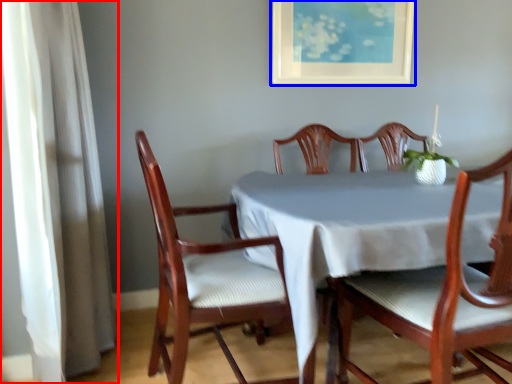
Question: Among these objects, which one is nearest to the camera, curtain (highlighted by a red box) or picture frame (highlighted by a blue box)?

Choices:
 (A) curtain
 (B) picture frame

Answer: (A)